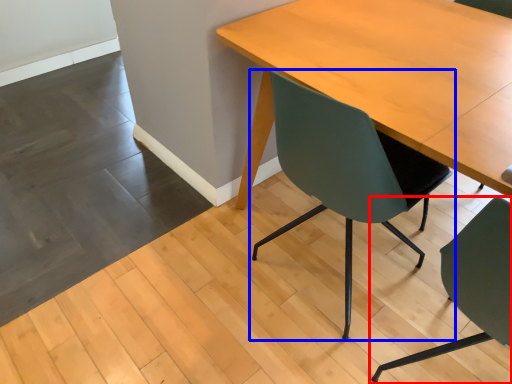
Question: Among these objects, which one is farthest to the camera, chair (highlighted by a red box) or chair (highlighted by a blue box)?

Choices:
 (A) chair
 (B) chair

Answer: (B)